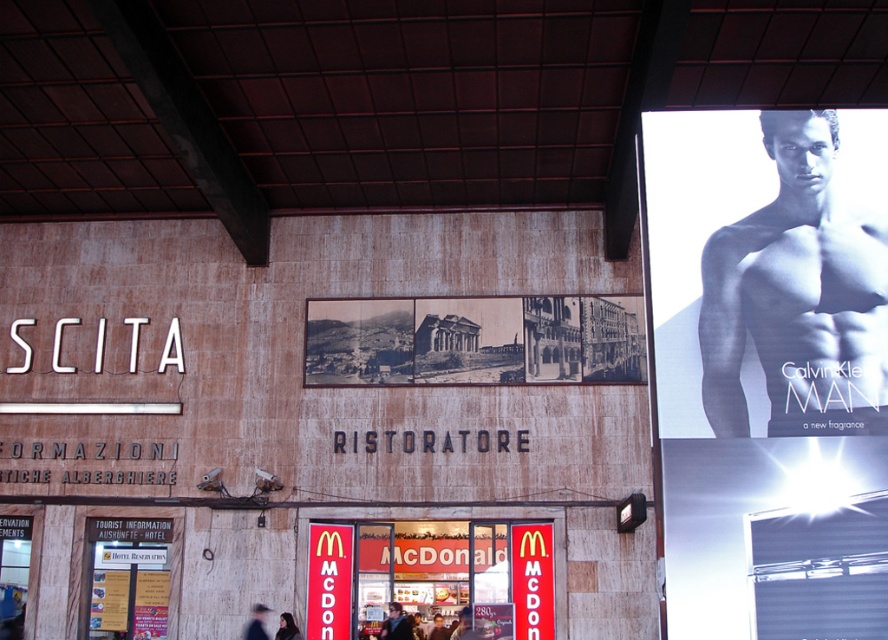
From the picture: Is black skin at upper right shorter than dark blue fabric at lower center?

Incorrect, black skin at upper right's height does not fall short of dark blue fabric at lower center's.

Can you confirm if black skin at upper right is taller than dark blue fabric at lower center?

Yes, black skin at upper right is taller than dark blue fabric at lower center.

What are the coordinates of `black skin at upper right` in the screenshot? It's located at (798, 296).

In order to click on red signboard at center in this screenshot , I will do `click(430, 577)`.

Which is behind, point (445, 580) or point (284, 628)?

The point (445, 580) is behind.

What are the coordinates of `red signboard at center` in the screenshot? It's located at (430, 577).

Who is lower down, black skin at upper right or dark brown hair at lower left?

Positioned lower is dark brown hair at lower left.

Who is higher up, black skin at upper right or dark brown hair at lower left?

black skin at upper right

Who is more forward, (882, 388) or (290, 614)?

Point (882, 388) is in front.

Where is `black skin at upper right`? The height and width of the screenshot is (640, 888). black skin at upper right is located at coordinates (798, 296).